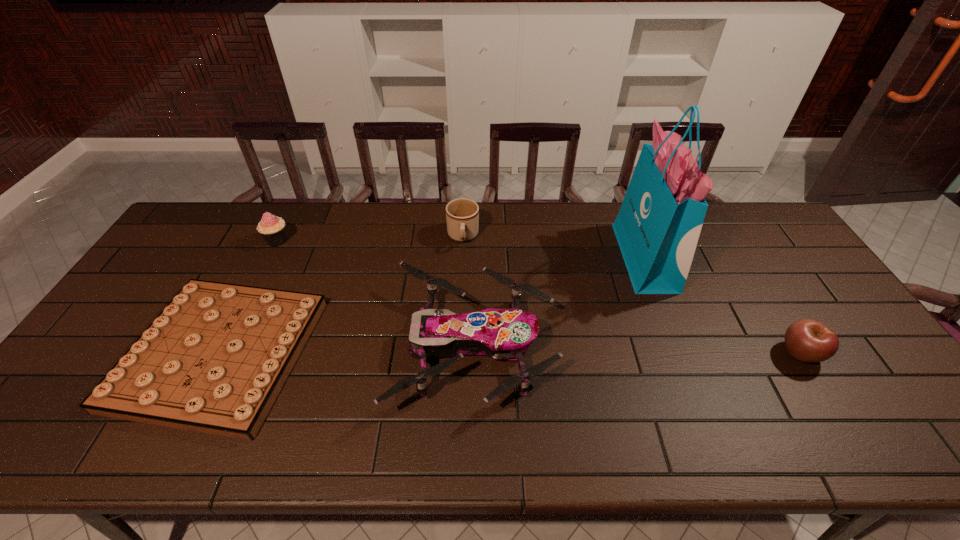
The width and height of the screenshot is (960, 540). Identify the location of free area in between the tallest object and the drone. (560, 302).

Identify the location of vacant region between the apple and the mug. The image size is (960, 540). (632, 295).

Where is `free space between the cupcake and the shopping bag`? free space between the cupcake and the shopping bag is located at coordinates (461, 249).

Point out which object is positioned as the fourth nearest to the rightmost object. Please provide its 2D coordinates. Your answer should be formatted as a tuple, i.e. [(x, y)], where the tuple contains the x and y coordinates of a point satisfying the conditions above.

[(214, 360)]

Choose which object is the fourth nearest neighbor to the apple. Please provide its 2D coordinates. Your answer should be formatted as a tuple, i.e. [(x, y)], where the tuple contains the x and y coordinates of a point satisfying the conditions above.

[(214, 360)]

Locate an element on the screen. The image size is (960, 540). vacant space that satisfies the following two spatial constraints: 1. on the front side of the shopping bag; 2. on the front-facing side of the drone is located at coordinates (680, 346).